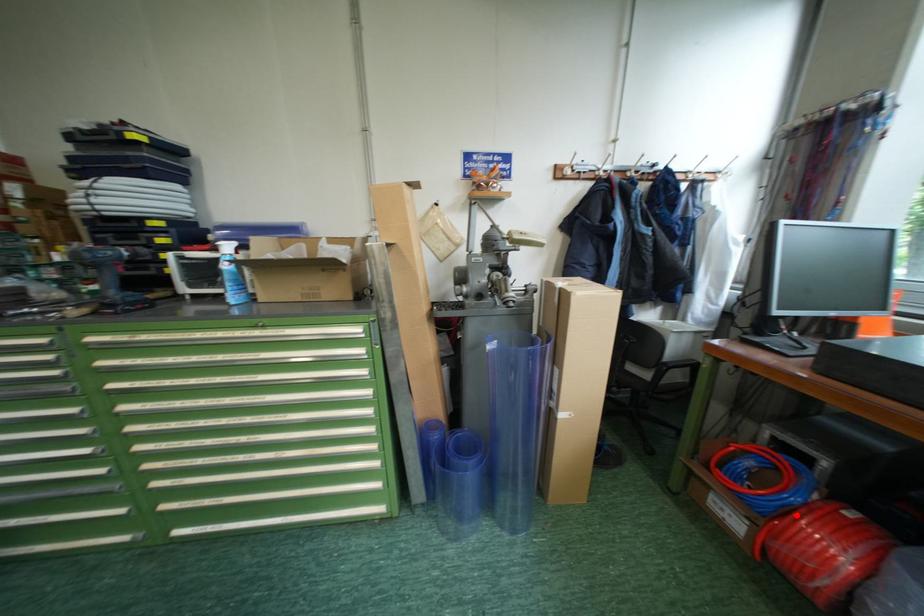
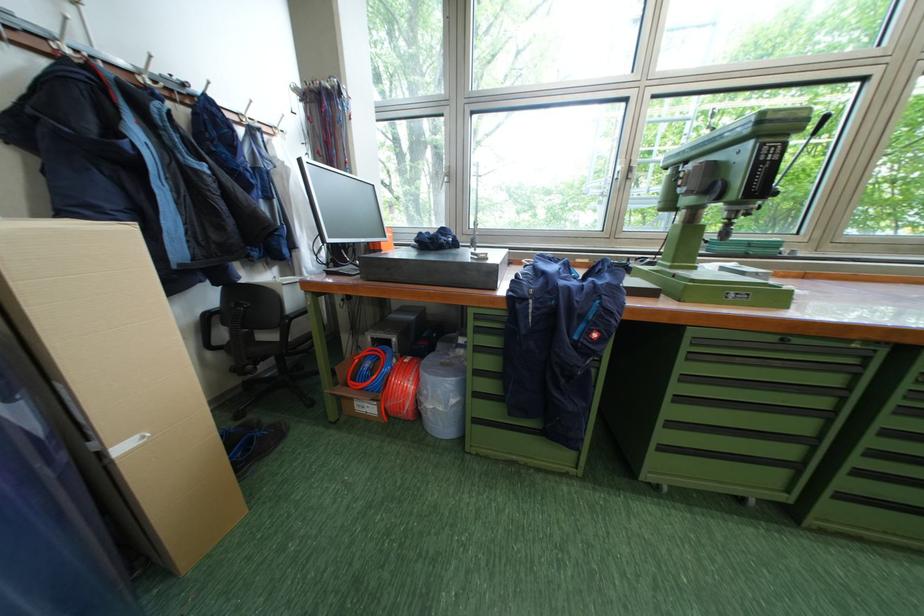
Locate, in the second image, the point that corresponds to the highlighted location in the first image.

(396, 383)